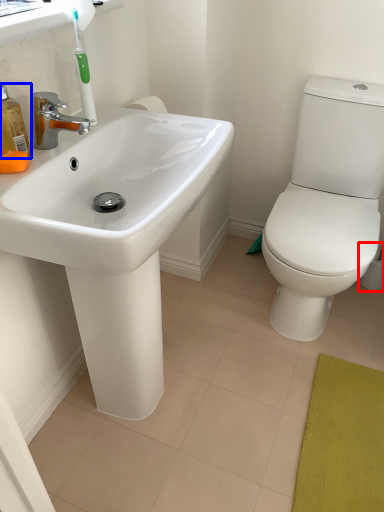
Question: Which of the following is the closest to the observer, toilet paper (highlighted by a red box) or soap dispenser (highlighted by a blue box)?

Choices:
 (A) toilet paper
 (B) soap dispenser

Answer: (B)